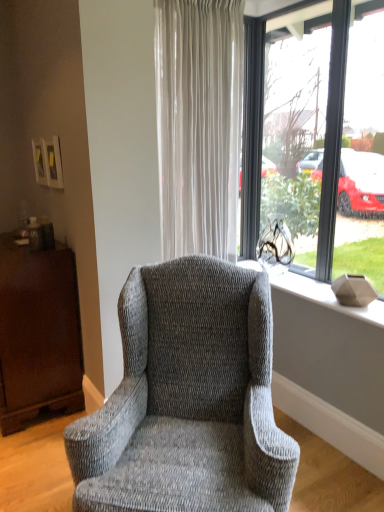
In order to face mahogany wood dresser at left, should I rotate leftwards or rightwards?

Rotate left and turn 21.900 degrees.

What do you see at coordinates (188, 400) in the screenshot? The image size is (384, 512). I see `textured gray wingback chair at center` at bounding box center [188, 400].

Locate an element on the screen. This screenshot has width=384, height=512. matte gray vase at right is located at coordinates (323, 295).

Are white sheer curtain at center and textured gray wingback chair at center far apart?

That's not correct — white sheer curtain at center is a little close to textured gray wingback chair at center.

Measure the distance from white sheer curtain at center to textured gray wingback chair at center.

A distance of 37.01 inches exists between white sheer curtain at center and textured gray wingback chair at center.

From the image's perspective, does white sheer curtain at center appear higher than textured gray wingback chair at center?

Indeed, from the image's perspective, white sheer curtain at center is shown above textured gray wingback chair at center.

Is the depth of white sheer curtain at center less than that of textured gray wingback chair at center?

No, it is not.

Based on the photo, which of these two, textured gray wingback chair at center or transparent glass window at center, is smaller?

Smaller between the two is transparent glass window at center.

Does textured gray wingback chair at center appear on the left side of transparent glass window at center?

Yes.

The image size is (384, 512). What are the coordinates of `chair in front of the transparent glass window at center` in the screenshot? It's located at (188, 400).

Is textured gray wingback chair at center turned away from transparent glass window at center?

No, transparent glass window at center is not at the back of textured gray wingback chair at center.

Relative to textured gray wingback chair at center, is matte gray vase at right in front or behind?

matte gray vase at right is behind textured gray wingback chair at center.

Is matte gray vase at right next to textured gray wingback chair at center?

No, matte gray vase at right is not touching textured gray wingback chair at center.

Which of these two, matte gray vase at right or textured gray wingback chair at center, is bigger?

Bigger between the two is textured gray wingback chair at center.

Identify the location of window sill above the textured gray wingback chair at center (from the image's perspective). (323, 295).

Can you confirm if mahogany wood dresser at left is bigger than transparent glass window at center?

Correct, mahogany wood dresser at left is larger in size than transparent glass window at center.

Looking at this image, is mahogany wood dresser at left not near transparent glass window at center?

Absolutely, mahogany wood dresser at left is distant from transparent glass window at center.

Considering the relative sizes of mahogany wood dresser at left and transparent glass window at center in the image provided, is mahogany wood dresser at left thinner than transparent glass window at center?

In fact, mahogany wood dresser at left might be wider than transparent glass window at center.

Could transparent glass window at center be considered to be inside mahogany wood dresser at left?

No, transparent glass window at center is located outside of mahogany wood dresser at left.

Does transparent glass window at center contain mahogany wood dresser at left?

Actually, mahogany wood dresser at left is outside transparent glass window at center.

From the image's perspective, which one is positioned higher, transparent glass window at center or mahogany wood dresser at left?

transparent glass window at center appears higher in the image.

Is the position of transparent glass window at center more distant than that of mahogany wood dresser at left?

No, it is in front of mahogany wood dresser at left.

In terms of width, does transparent glass window at center look wider or thinner when compared to mahogany wood dresser at left?

Considering their sizes, transparent glass window at center looks slimmer than mahogany wood dresser at left.

From the image's perspective, is matte gray vase at right beneath mahogany wood dresser at left?

Actually, matte gray vase at right appears above mahogany wood dresser at left in the image.

Does matte gray vase at right appear on the right side of mahogany wood dresser at left?

Correct, you'll find matte gray vase at right to the right of mahogany wood dresser at left.

Does matte gray vase at right lie in front of mahogany wood dresser at left?

That is True.

Considering the sizes of objects matte gray vase at right and mahogany wood dresser at left in the image provided, who is smaller, matte gray vase at right or mahogany wood dresser at left?

Smaller between the two is matte gray vase at right.

Would you say white sheer curtain at center is to the left or to the right of mahogany wood dresser at left in the picture?

Based on their positions, white sheer curtain at center is located to the right of mahogany wood dresser at left.

Which is in front, white sheer curtain at center or mahogany wood dresser at left?

white sheer curtain at center is more forward.

The image size is (384, 512). There is a mahogany wood dresser at left. What are the coordinates of `curtain above it (from a real-world perspective)` in the screenshot? It's located at (198, 123).

Where is `curtain on the right of textured gray wingback chair at center`? curtain on the right of textured gray wingback chair at center is located at coordinates (198, 123).

This screenshot has height=512, width=384. I want to click on chair below the transparent glass window at center (from the image's perspective), so click(x=188, y=400).

When comparing their distances from transparent glass window at center, does mahogany wood dresser at left or matte gray vase at right seem further?

mahogany wood dresser at left.

Based on their spatial positions, is mahogany wood dresser at left or textured gray wingback chair at center further from transparent glass window at center?

Among the two, mahogany wood dresser at left is located further to transparent glass window at center.

Looking at the image, which one is located closer to matte gray vase at right, textured gray wingback chair at center or mahogany wood dresser at left?

textured gray wingback chair at center is closer to matte gray vase at right.

Estimate the real-world distances between objects in this image. Which object is further from transparent glass window at center, white sheer curtain at center or matte gray vase at right?

matte gray vase at right is positioned further to the anchor transparent glass window at center.

From the picture: From the image, which object appears to be nearer to mahogany wood dresser at left, transparent glass window at center or white sheer curtain at center?

Among the two, white sheer curtain at center is located nearer to mahogany wood dresser at left.

When comparing their distances from mahogany wood dresser at left, does white sheer curtain at center or transparent glass window at center seem closer?

Based on the image, white sheer curtain at center appears to be nearer to mahogany wood dresser at left.

Estimate the real-world distances between objects in this image. Which object is closer to textured gray wingback chair at center, transparent glass window at center or white sheer curtain at center?

white sheer curtain at center is positioned closer to the anchor textured gray wingback chair at center.

Considering their positions, is matte gray vase at right positioned closer to transparent glass window at center than textured gray wingback chair at center?

Among the two, matte gray vase at right is located nearer to transparent glass window at center.

The image size is (384, 512). I want to click on window between mahogany wood dresser at left and matte gray vase at right from left to right, so click(x=325, y=138).

Where is `curtain located between mahogany wood dresser at left and transparent glass window at center in the left-right direction`? curtain located between mahogany wood dresser at left and transparent glass window at center in the left-right direction is located at coordinates (198, 123).

This screenshot has width=384, height=512. I want to click on dresser that lies between white sheer curtain at center and textured gray wingback chair at center from top to bottom, so click(38, 333).

I want to click on window between white sheer curtain at center and matte gray vase at right vertically, so click(x=325, y=138).